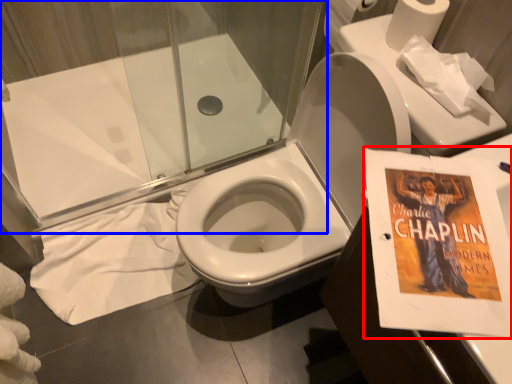
Question: Which object appears closest to the camera in this image, paperback book (highlighted by a red box) or shower door (highlighted by a blue box)?

Choices:
 (A) paperback book
 (B) shower door

Answer: (A)